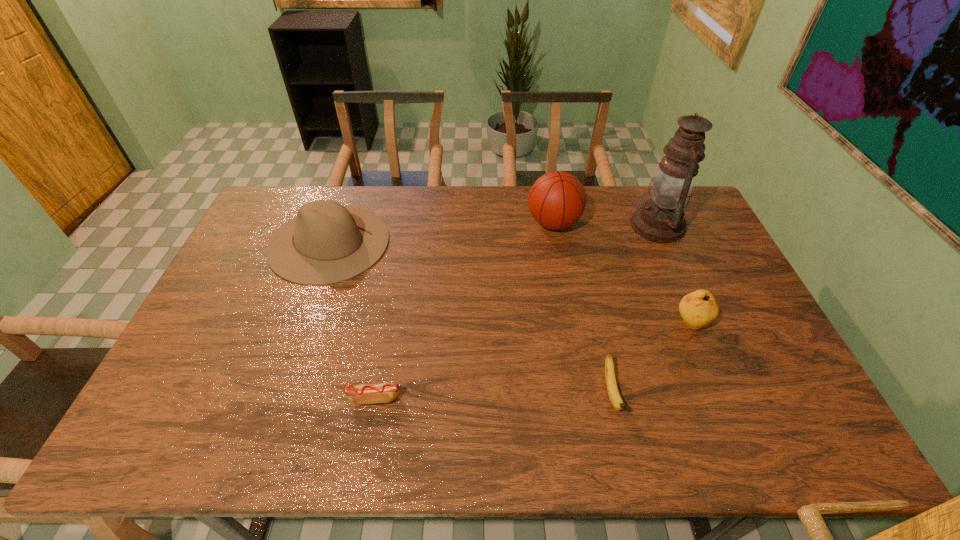
At what (x,y) coordinates should I click in order to perform the action: click on free spot located 0.060m at the stem of the banana. Please return your answer as a coordinate pair (x, y). Looking at the image, I should click on (623, 448).

I want to click on vacant space situated 0.090m on the back of the sausage, so click(x=382, y=357).

Locate an element on the screen. This screenshot has height=540, width=960. oil lamp at the far edge is located at coordinates (661, 219).

I want to click on basketball at the far edge, so point(557,200).

This screenshot has width=960, height=540. Identify the location of sombrero present at the far edge. (322, 245).

Identify the location of object positioned at the near edge. The width and height of the screenshot is (960, 540). (614, 396).

Locate an element on the screen. object located in the left edge section of the desktop is located at coordinates (322, 245).

You are a GUI agent. You are given a task and a screenshot of the screen. Output one action in this format:
    pyautogui.click(x=<x>, y=<y>)
    Task: Click on the oil lamp that is positioned at the right edge
    This screenshot has width=960, height=540.
    Given the screenshot: What is the action you would take?
    [661, 219]

The height and width of the screenshot is (540, 960). Find the location of `pear at the right edge`. pear at the right edge is located at coordinates (698, 309).

Identify the location of object that is at the far left corner. The image size is (960, 540). pos(322,245).